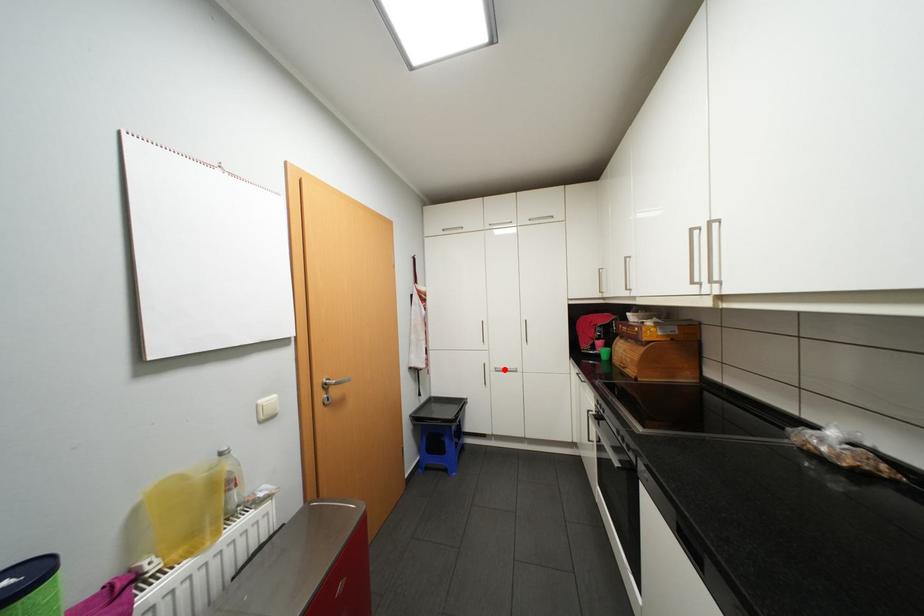
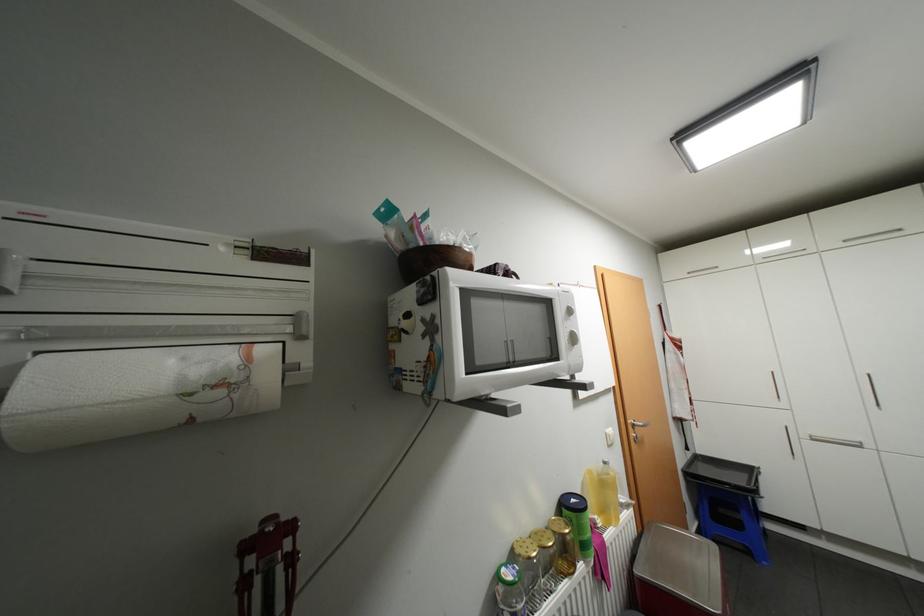
Question: I am providing you with two images of the same scene from different viewpoints. A red point is shown in image1. For the corresponding object point in image2, is it positioned nearer or farther from the camera?

Choices:
 (A) Nearer
 (B) Farther

Answer: (A)